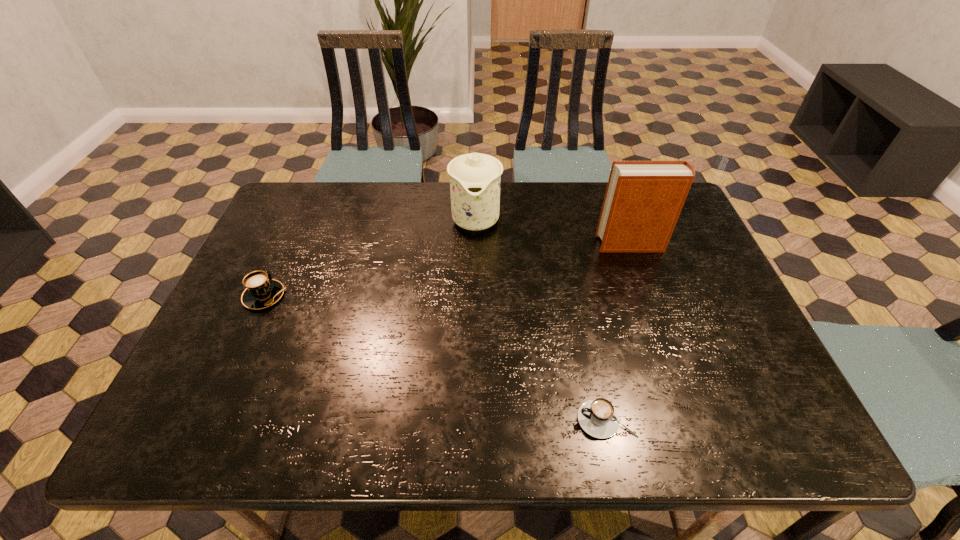
At what (x,y) coordinates should I click in order to perform the action: click on the rightmost object. Please return your answer as a coordinate pair (x, y). The height and width of the screenshot is (540, 960). Looking at the image, I should click on (643, 200).

Identify the location of chinaware. The image size is (960, 540). (475, 178).

I want to click on the left cappuccino, so click(261, 292).

Locate an element on the screen. the leftmost object is located at coordinates (261, 292).

Locate an element on the screen. This screenshot has width=960, height=540. the third object from left to right is located at coordinates (598, 418).

I want to click on the shortest object, so click(598, 418).

I want to click on free location located 0.180m on the open cover of the rightmost object, so click(535, 244).

Identify the location of free space located 0.090m on the open cover of the rightmost object. (565, 244).

This screenshot has height=540, width=960. In order to click on free space located 0.100m on the open cover of the rightmost object in this screenshot , I will do click(x=563, y=244).

The image size is (960, 540). Find the location of `free space located 0.280m on the spout of the third object from right to left`. free space located 0.280m on the spout of the third object from right to left is located at coordinates (474, 320).